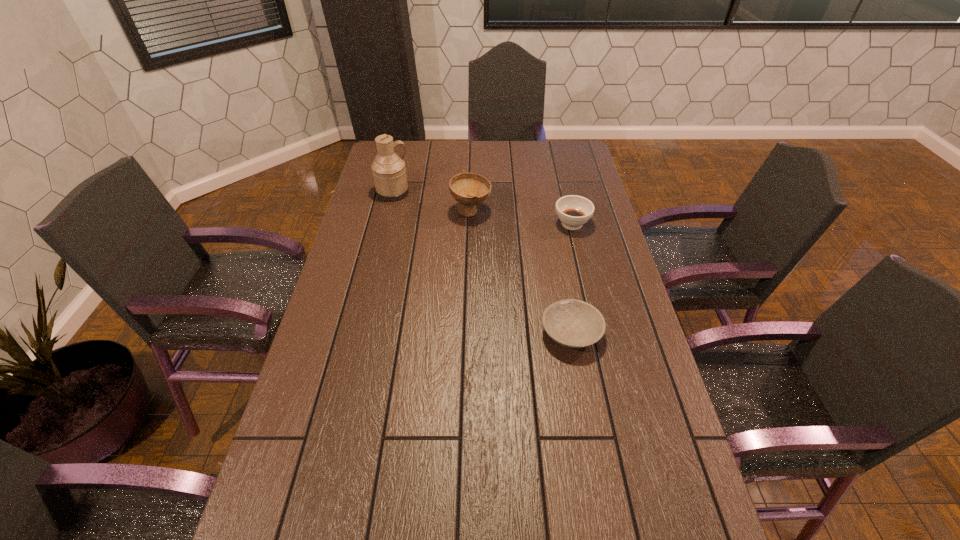
Identify the location of pitcher. (389, 171).

Where is `the leftmost object`? The image size is (960, 540). the leftmost object is located at coordinates (389, 171).

Locate an element on the screen. The image size is (960, 540). the taller soup bowl is located at coordinates (469, 189).

Locate an element on the screen. This screenshot has height=540, width=960. the third shortest object is located at coordinates (469, 189).

In order to click on the shorter soup bowl in this screenshot , I will do `click(573, 211)`.

Locate an element on the screen. The width and height of the screenshot is (960, 540). the right soup bowl is located at coordinates (573, 211).

Find the location of a particular element. This screenshot has height=540, width=960. the shortest object is located at coordinates (572, 323).

You are a GUI agent. You are given a task and a screenshot of the screen. Output one action in this format:
    pyautogui.click(x=<x>, y=<y>)
    Task: Click on the bowl
    Image resolution: width=960 pixels, height=540 pixels.
    Given the screenshot: What is the action you would take?
    pyautogui.click(x=572, y=323)

What are the coordinates of `free region located on the back of the tallest object` in the screenshot? It's located at (403, 153).

You are a GUI agent. You are given a task and a screenshot of the screen. Output one action in this format:
    pyautogui.click(x=<x>, y=<y>)
    Task: Click on the free spot located on the right of the taller soup bowl
    
    Given the screenshot: What is the action you would take?
    pyautogui.click(x=529, y=212)